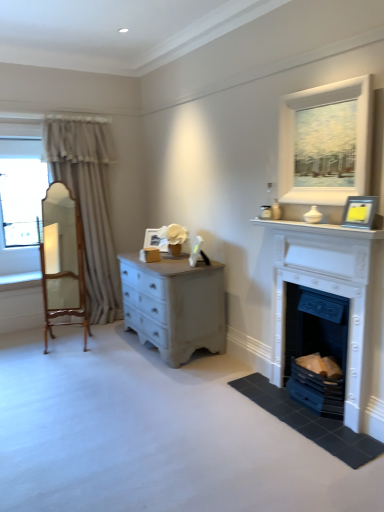
Question: Considering the positions of white painted stone fireplace at right, acting as the 2th fireplace starting from the bottom, and white matte picture frame at center, which is the 1th picture frame from left to right, in the image, is white painted stone fireplace at right, acting as the 2th fireplace starting from the bottom, wider or thinner than white matte picture frame at center, which is the 1th picture frame from left to right,?

Choices:
 (A) wide
 (B) thin

Answer: (A)

Question: From a real-world perspective, is white painted stone fireplace at right, acting as the 2th fireplace starting from the bottom, physically located above or below white matte picture frame at center, which is the 1th picture frame from left to right?

Choices:
 (A) below
 (B) above

Answer: (A)

Question: Based on their relative distances, which object is nearer to the white painted fireplace at lower right, which is the first fireplace in bottom-to-top order?

Choices:
 (A) silver metallic picture frame at upper right, arranged as the first picture frame when viewed from the right
 (B) white glossy mantle at upper right
 (C) white painted stone fireplace at right, acting as the 2th fireplace starting from the bottom
 (D) wooden armchair at left
 (E) beige fabric curtain at left

Answer: (C)

Question: Based on their relative distances, which object is nearer to the white painted fireplace at lower right, which is the first fireplace in bottom-to-top order?

Choices:
 (A) wooden armchair at left
 (B) silver metallic picture frame at upper right, the second picture frame positioned from the left
 (C) white painted stone fireplace at right, acting as the 2th fireplace starting from the bottom
 (D) matte white painting at upper right
 (E) white matte picture frame at center, which is the second picture frame from front to back

Answer: (C)